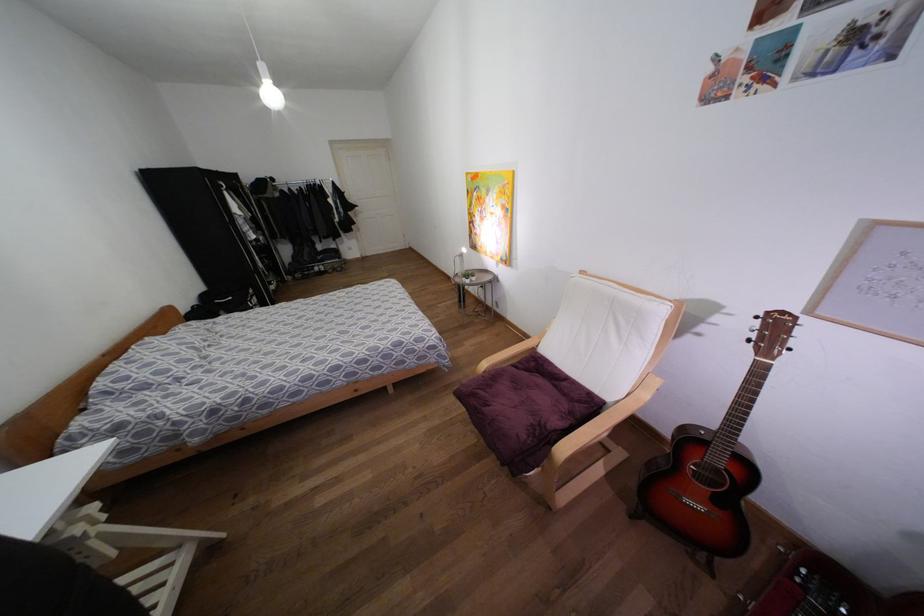
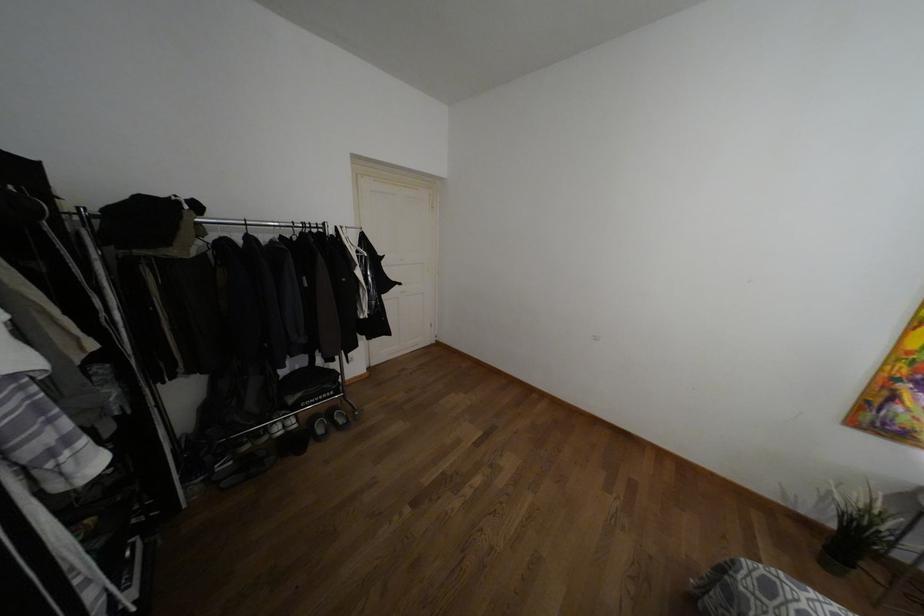
Find the pixel in the second image that matches (315,268) in the first image.

(275, 427)